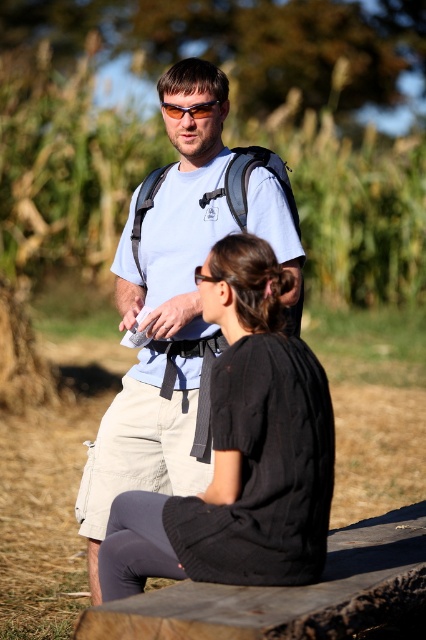
Is point (224, 502) farther from camera compared to point (210, 106)?

No, it is not.

Can you confirm if black textured sweater at center is positioned to the left of sunglasses at center?

In fact, black textured sweater at center is to the right of sunglasses at center.

This screenshot has height=640, width=426. Describe the element at coordinates (241, 451) in the screenshot. I see `black textured sweater at center` at that location.

I want to click on black textured sweater at center, so click(x=241, y=451).